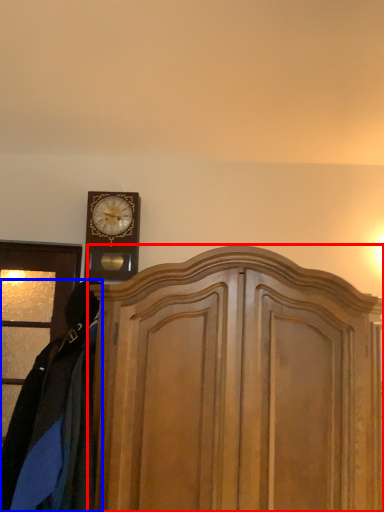
Question: Among these objects, which one is nearest to the camera, dresser (highlighted by a red box) or clothing (highlighted by a blue box)?

Choices:
 (A) dresser
 (B) clothing

Answer: (B)